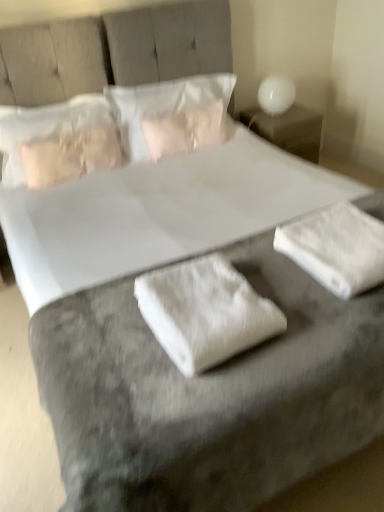
Image resolution: width=384 pixels, height=512 pixels. Describe the element at coordinates (162, 105) in the screenshot. I see `white soft pillow at center, which appears as the second pillow when viewed from the left` at that location.

Identify the location of white glossy table lamp at upper right. (276, 94).

Measure the distance between white glossy table lamp at upper right and camera.

white glossy table lamp at upper right is 9.27 feet from camera.

What do you see at coordinates (339, 245) in the screenshot?
I see `white fluffy towel at lower right, positioned as the first material in right-to-left order` at bounding box center [339, 245].

Find the location of a particular element. This screenshot has height=512, width=384. white fabric at center, the second material positioned from the right is located at coordinates (205, 312).

Which object is further away from the camera taking this photo, white soft pillow at center, the first pillow from the right, or white glossy table lamp at upper right?

white glossy table lamp at upper right is more distant.

From a real-world perspective, which is physically below, white soft pillow at center, the first pillow from the right, or white glossy table lamp at upper right?

white glossy table lamp at upper right is physically lower.

Which pillow is the 1st one when counting from the left side of the white glossy table lamp at upper right? Please provide its 2D coordinates.

[(162, 105)]

Is white fabric at center, the second material positioned from the right, beside white glossy nightstand at upper right?

white fabric at center, the second material positioned from the right, is not next to white glossy nightstand at upper right, and they're not touching.

Where is `material that is the 2nd one above the white glossy nightstand at upper right (from a real-world perspective)`? material that is the 2nd one above the white glossy nightstand at upper right (from a real-world perspective) is located at coordinates (205, 312).

Is the position of white fabric at center, the second material positioned from the right, more distant than that of white glossy nightstand at upper right?

That is False.

Can you confirm if white fabric at center, the second material positioned from the right, is smaller than white glossy nightstand at upper right?

Yes.

Is white glossy nightstand at upper right turned away from white fluffy towel at lower right, arranged as the second material when viewed from the left?

No.

Looking at this image, which of these two, white glossy nightstand at upper right or white fluffy towel at lower right, arranged as the second material when viewed from the left, stands taller?

white glossy nightstand at upper right is taller.

Looking at their sizes, would you say white glossy nightstand at upper right is wider or thinner than white fluffy towel at lower right, positioned as the first material in right-to-left order?

Clearly, white glossy nightstand at upper right has more width compared to white fluffy towel at lower right, positioned as the first material in right-to-left order.

Based on the photo, can you confirm if white glossy nightstand at upper right is smaller than white soft pillow at center, which appears as the second pillow when viewed from the left?

Yes.

Between point (279, 142) and point (163, 102), which one is positioned in front?

The point (163, 102) is closer to the camera.

Is white glossy nightstand at upper right spatially inside white soft pillow at center, the first pillow from the right, or outside of it?

white glossy nightstand at upper right lies outside white soft pillow at center, the first pillow from the right.

From a real-world perspective, which material is the 1st one underneath the white soft pillow at center, the first pillow from the right? Please provide its 2D coordinates.

[(205, 312)]

Which object is closer to the camera taking this photo, white soft pillow at center, the first pillow from the right, or white fabric at center, positioned as the first material in left-to-right order?

white fabric at center, positioned as the first material in left-to-right order.

How distant is white soft pillow at center, the first pillow from the right, from white fabric at center, positioned as the first material in left-to-right order?

A distance of 4.76 feet exists between white soft pillow at center, the first pillow from the right, and white fabric at center, positioned as the first material in left-to-right order.

Looking at the image, does white soft pillow at center, the first pillow from the right, seem bigger or smaller compared to white fabric at center, the second material positioned from the right?

Considering their sizes, white soft pillow at center, the first pillow from the right, takes up more space than white fabric at center, the second material positioned from the right.

Who is more distant, white fluffy towel at lower right, arranged as the second material when viewed from the left, or white soft pillow at center, which appears as the second pillow when viewed from the left?

white soft pillow at center, which appears as the second pillow when viewed from the left, is further away from the camera.

Between white fluffy towel at lower right, arranged as the second material when viewed from the left, and white soft pillow at center, which appears as the second pillow when viewed from the left, which one appears on the right side from the viewer's perspective?

From the viewer's perspective, white fluffy towel at lower right, arranged as the second material when viewed from the left, appears more on the right side.

From a real-world perspective, relative to white soft pillow at center, the first pillow from the right, is white fluffy towel at lower right, positioned as the first material in right-to-left order, vertically above or below?

In terms of real-world spatial position, white fluffy towel at lower right, positioned as the first material in right-to-left order, is below white soft pillow at center, the first pillow from the right.

Considering the sizes of objects white fluffy towel at lower right, arranged as the second material when viewed from the left, and white soft pillow at center, which appears as the second pillow when viewed from the left, in the image provided, who is wider, white fluffy towel at lower right, arranged as the second material when viewed from the left, or white soft pillow at center, which appears as the second pillow when viewed from the left,?

white fluffy towel at lower right, arranged as the second material when viewed from the left.

Does white soft pillow at center, which appears as the second pillow when viewed from the left, have a greater height compared to white fluffy towel at lower right, arranged as the second material when viewed from the left?

Yes.

Can you tell me how much white soft pillow at center, the first pillow from the right, and white fluffy towel at lower right, arranged as the second material when viewed from the left, differ in facing direction?

There is a 2.74-degree angle between the facing directions of white soft pillow at center, the first pillow from the right, and white fluffy towel at lower right, arranged as the second material when viewed from the left.

From a real-world perspective, which material is the 2nd one underneath the white soft pillow at center, the first pillow from the right? Please provide its 2D coordinates.

[(339, 245)]

Considering the relative sizes of white soft pillow at center, the first pillow from the right, and white fluffy towel at lower right, positioned as the first material in right-to-left order, in the image provided, is white soft pillow at center, the first pillow from the right, bigger than white fluffy towel at lower right, positioned as the first material in right-to-left order,?

Indeed, white soft pillow at center, the first pillow from the right, has a larger size compared to white fluffy towel at lower right, positioned as the first material in right-to-left order.

Locate an element on the screen. The image size is (384, 512). the 1st pillow counting from the left side of the white glossy table lamp at upper right is located at coordinates (162, 105).

This screenshot has height=512, width=384. I want to click on material that is the 2nd one when counting forward from the white glossy nightstand at upper right, so click(x=205, y=312).

Based on their spatial positions, is white glossy table lamp at upper right or white fluffy towel at lower right, positioned as the first material in right-to-left order, closer to white fabric at center, the second material positioned from the right?

white fluffy towel at lower right, positioned as the first material in right-to-left order, is closer to white fabric at center, the second material positioned from the right.

Estimate the real-world distances between objects in this image. Which object is further from white glossy nightstand at upper right, satin beige pillow at upper left, the first pillow viewed from the left, or white glossy table lamp at upper right?

Based on the image, satin beige pillow at upper left, the first pillow viewed from the left, appears to be further to white glossy nightstand at upper right.

Based on their spatial positions, is white fabric at center, the second material positioned from the right, or white soft pillow at center, which appears as the second pillow when viewed from the left, further from satin beige pillow at upper left, the first pillow viewed from the left?

Based on the image, white fabric at center, the second material positioned from the right, appears to be further to satin beige pillow at upper left, the first pillow viewed from the left.

When comparing their distances from white glossy table lamp at upper right, does white fluffy towel at lower right, arranged as the second material when viewed from the left, or white fabric at center, the second material positioned from the right, seem closer?

The object closer to white glossy table lamp at upper right is white fluffy towel at lower right, arranged as the second material when viewed from the left.

Based on their spatial positions, is satin beige pillow at upper left, placed as the 2th pillow when sorted from right to left, or white fabric at center, positioned as the first material in left-to-right order, closer to white glossy nightstand at upper right?

satin beige pillow at upper left, placed as the 2th pillow when sorted from right to left, is positioned closer to the anchor white glossy nightstand at upper right.

Estimate the real-world distances between objects in this image. Which object is further from white glossy nightstand at upper right, white glossy table lamp at upper right or white soft pillow at center, the first pillow from the right?

Based on the image, white soft pillow at center, the first pillow from the right, appears to be further to white glossy nightstand at upper right.

When comparing their distances from white glossy nightstand at upper right, does white fluffy towel at lower right, positioned as the first material in right-to-left order, or white fabric at center, the second material positioned from the right, seem further?

white fabric at center, the second material positioned from the right.

Considering their positions, is satin beige pillow at upper left, the first pillow viewed from the left, positioned further to white glossy table lamp at upper right than white fluffy towel at lower right, positioned as the first material in right-to-left order?

Based on the image, white fluffy towel at lower right, positioned as the first material in right-to-left order, appears to be further to white glossy table lamp at upper right.

Locate an element on the screen. This screenshot has height=512, width=384. pillow situated between satin beige pillow at upper left, the first pillow viewed from the left, and white glossy nightstand at upper right from left to right is located at coordinates (162, 105).

Find the location of a particular element. This screenshot has height=512, width=384. table lamp between white soft pillow at center, the first pillow from the right, and white glossy nightstand at upper right is located at coordinates (276, 94).

Locate an element on the screen. material between white fabric at center, positioned as the first material in left-to-right order, and white glossy table lamp at upper right from front to back is located at coordinates (339, 245).

The height and width of the screenshot is (512, 384). I want to click on material between white fabric at center, the second material positioned from the right, and white glossy nightstand at upper right in the front-back direction, so click(x=339, y=245).